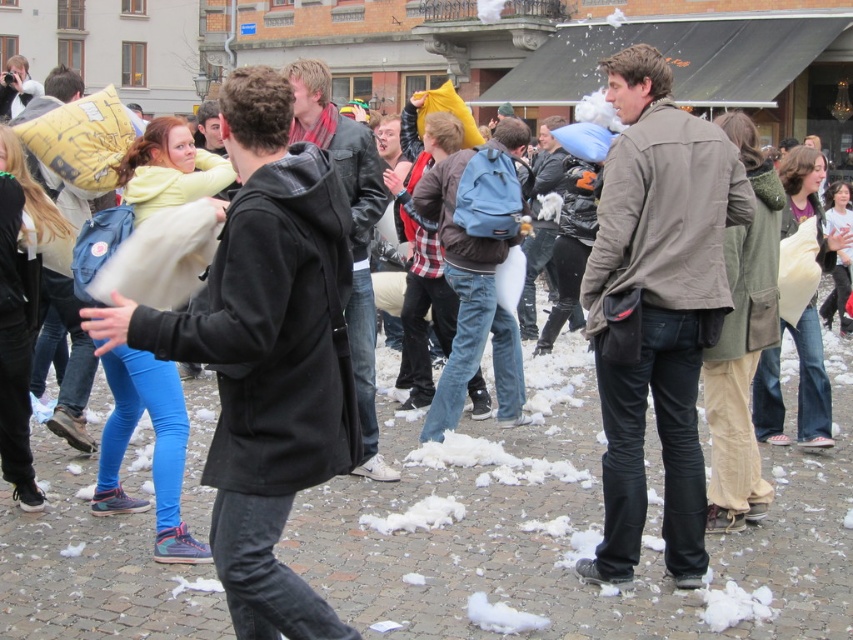
Is the position of black leather jacket at center less distant than that of dark brown leather jacket at center?

Yes, black leather jacket at center is in front of dark brown leather jacket at center.

Does black leather jacket at center have a larger size compared to dark brown leather jacket at center?

No, black leather jacket at center is not bigger than dark brown leather jacket at center.

Is point (366, 371) in front of point (532, 163)?

Yes, point (366, 371) is closer to viewer.

At what (x,y) coordinates should I click in order to perform the action: click on black leather jacket at center. Please return your answer as a coordinate pair (x, y). Image resolution: width=853 pixels, height=640 pixels. Looking at the image, I should click on (350, 230).

Image resolution: width=853 pixels, height=640 pixels. What are the coordinates of `black matte jacket at center` in the screenshot? It's located at (265, 355).

Between point (242, 408) and point (67, 420), which one is positioned in front?

Point (242, 408) is more forward.

Describe the element at coordinates (265, 355) in the screenshot. The image size is (853, 640). I see `black matte jacket at center` at that location.

Locate an element on the screen. black matte jacket at center is located at coordinates (265, 355).

Who is more distant from viewer, (618,160) or (534,264)?

Positioned behind is point (534,264).

I want to click on khaki cotton jacket at center, so click(656, 307).